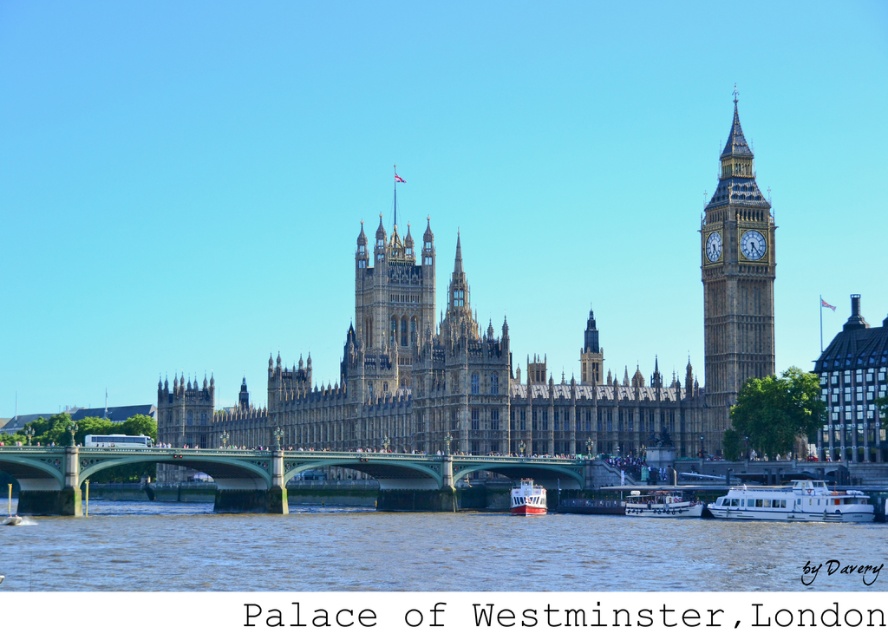
You are a tourist standing on the green bridge and want to take a photo of the brown water at lower center and the golden stone clock tower at right. Which object should you focus on first if you want to capture both in one frame without moving the camera?

The brown water at lower center is wider than the golden stone clock tower at right, so you should focus on the brown water at lower center first to ensure it fits in the frame.

You are standing at the point with coordinates point (x=192, y=572) and want to walk to the point with coordinates point (x=517, y=493). According to the scene description, which direction should you face to move towards your destination?

Since point (x=192, y=572) is in front of point (x=517, y=493), you should face backward to move towards point (x=517, y=493) from point (x=192, y=572).

You are standing on the green bridge and looking down at the brown water at lower center and the white glossy boat at center. Which object is closer to you?

The brown water at lower center is closer to you because it is in front of the white glossy boat at center.